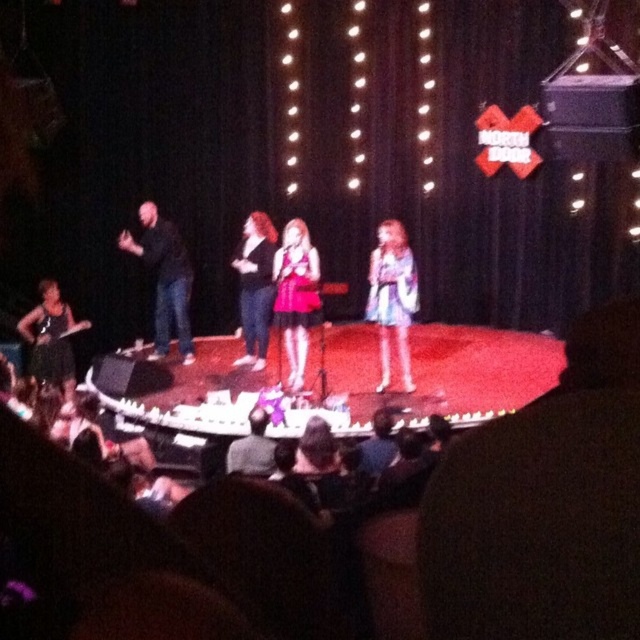
You are standing in the audience of the comedy club and want to get a closer look at the point marked at coordinates point (x=298, y=253). If you move forward 5 meters, will you be able to reach that point?

The distance between point (x=298, y=253) and the viewer is 6.45 meters. Moving forward 5 meters would leave you 1.45 meters away from the point, so yes, you can reach it by moving closer.

You are an audience member sitting in the front row of the comedy club. You notice two performers on stage wearing the matte blue dress at center and the matte black dress at center. Which performer is closer to the floor?

The matte blue dress at center is below the matte black dress at center, so the performer wearing the matte blue dress at center is closer to the floor.

You are an audience member sitting in the front row of the comedy club stage. You notice two points on the stage marked as point (400, 289) and point (252, 252). Which point is closer to you?

Point (400, 289) is in front of point (252, 252), so it is closer to you.